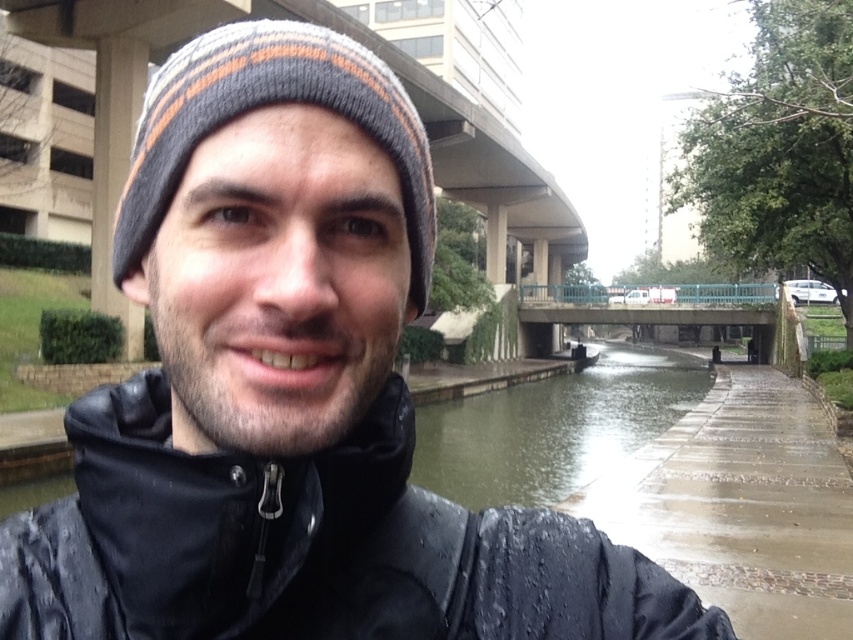
From the picture: You are a photographer trying to capture the scene of the knit woolen beanie at center and the greenish concrete river at center. Which object is shorter in height?

The knit woolen beanie at center is not as tall as the greenish concrete river at center, so the knit woolen beanie at center is shorter in height.

You are a photographer wanting to capture a wide shot of the waterproof black jacket at center and the greenish concrete river at center. Given that your camera can focus on objects within a 25 meter range, will both subjects be in focus?

The waterproof black jacket at center is 24.91 meters from greenish concrete river at center. Since the camera can focus within 25 meters, both subjects are within the focus range and will be in focus.

You are a fashion stylist preparing to take a photo of a model wearing a waterproof black jacket at center and a knit woolen beanie at center. Based on their sizes, which item should you adjust first to ensure they fit properly?

The waterproof black jacket at center is shorter than the knit woolen beanie at center, so you should adjust the knit woolen beanie at center first since it is taller and might require more adjustments to fit properly.